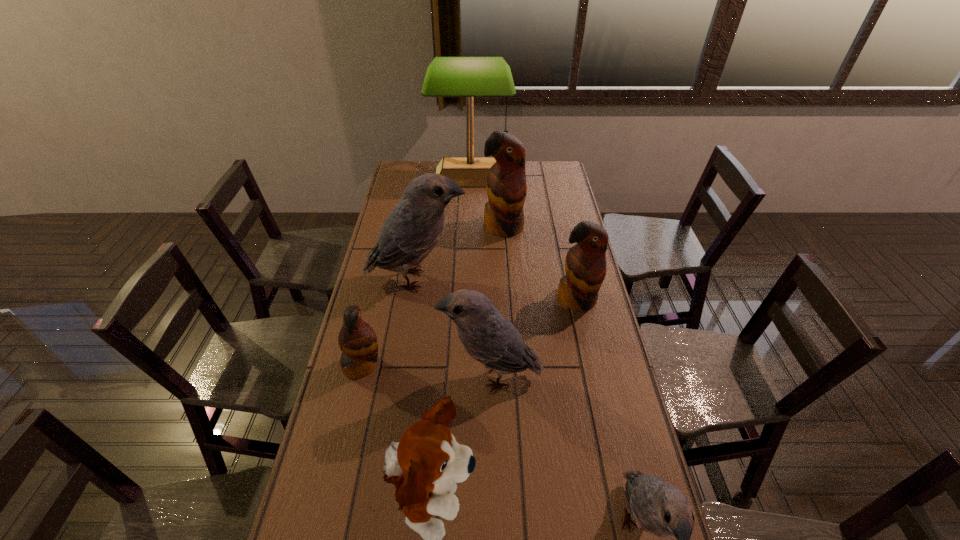
The height and width of the screenshot is (540, 960). Identify the location of vacant area at the far edge of the desktop. [x=530, y=181].

I want to click on blank area at the left edge, so point(370,308).

This screenshot has height=540, width=960. I want to click on free space at the right edge, so click(618, 403).

Where is `free region at the far left corner of the desktop`? Image resolution: width=960 pixels, height=540 pixels. free region at the far left corner of the desktop is located at coordinates (401, 183).

The height and width of the screenshot is (540, 960). Identify the location of free location at the far right corner. (550, 173).

I want to click on vacant point located between the farthest red parrot and the table lamp, so click(487, 202).

You are a GUI agent. You are given a task and a screenshot of the screen. Output one action in this format:
    pyautogui.click(x=<x>, y=<y>)
    Task: Click on the blank region between the farthest parrot and the second biggest gray parrot
    
    Given the screenshot: What is the action you would take?
    pyautogui.click(x=497, y=301)

At what (x,y) coordinates should I click in order to perform the action: click on vacant area between the farthest object and the second red parrot from right to left. Please return your answer as a coordinate pair (x, y). This screenshot has height=540, width=960. Looking at the image, I should click on (487, 202).

Where is `unoccupied area between the farthest gray parrot and the second smallest gray parrot`? The image size is (960, 540). unoccupied area between the farthest gray parrot and the second smallest gray parrot is located at coordinates [x=454, y=328].

You are a GUI agent. You are given a task and a screenshot of the screen. Output one action in this format:
    pyautogui.click(x=<x>, y=<y>)
    Task: Click on the closest object relative to the nearest red parrot
    The image size is (960, 540).
    Given the screenshot: What is the action you would take?
    pyautogui.click(x=486, y=335)